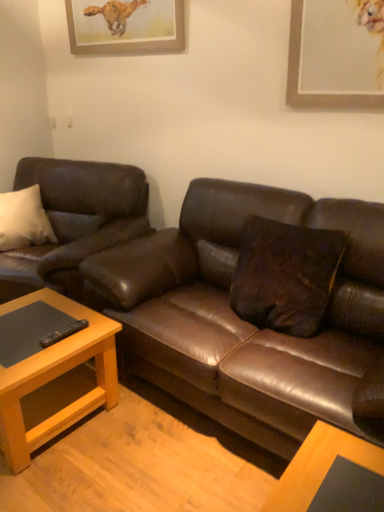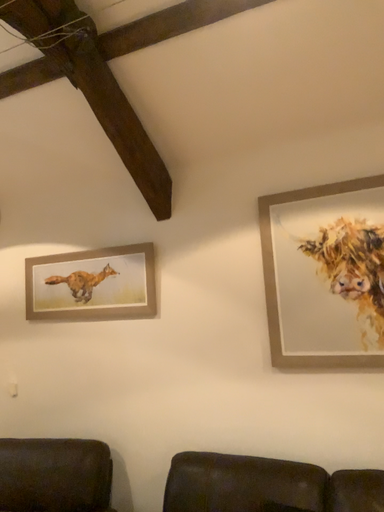
Question: How did the camera likely rotate when shooting the video?

Choices:
 (A) rotated downward
 (B) rotated upward

Answer: (B)